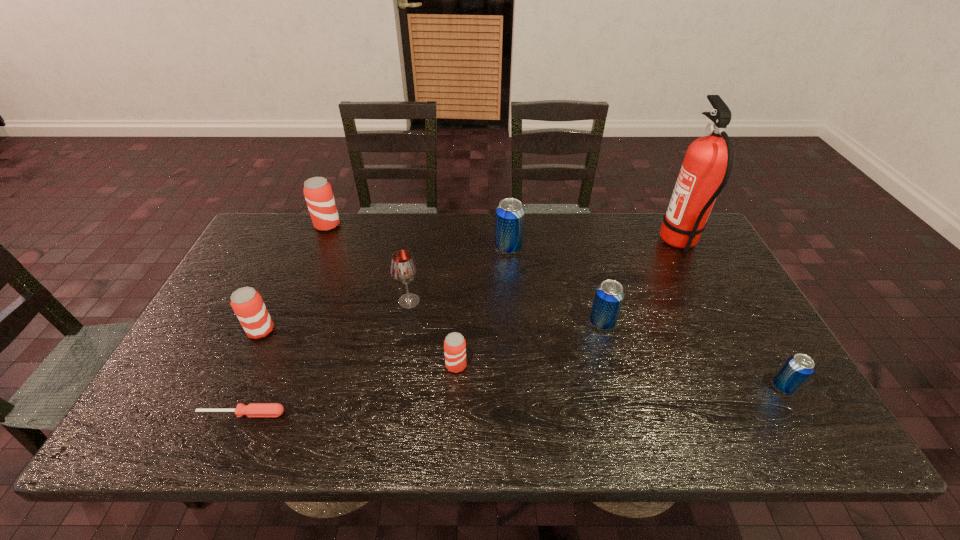
This screenshot has height=540, width=960. In order to click on the second beer can from right to left in this screenshot , I will do `click(609, 295)`.

The image size is (960, 540). I want to click on the smallest blue beer can, so click(797, 369).

This screenshot has height=540, width=960. Identify the location of the rightmost beer can. (797, 369).

Identify the location of the third beer can from left to right. (454, 345).

I want to click on the seventh farthest object, so click(x=454, y=345).

The height and width of the screenshot is (540, 960). What are the coordinates of `the shortest object` in the screenshot? It's located at (253, 409).

This screenshot has height=540, width=960. I want to click on screwdriver, so click(x=253, y=409).

Where is `vacant space located on the handle side of the red fire extinguisher`? vacant space located on the handle side of the red fire extinguisher is located at coordinates (573, 242).

Where is `vacant space located 0.240m on the handle side of the red fire extinguisher`? The image size is (960, 540). vacant space located 0.240m on the handle side of the red fire extinguisher is located at coordinates (586, 242).

Identify the location of free region located 0.320m on the handle side of the red fire extinguisher. (561, 242).